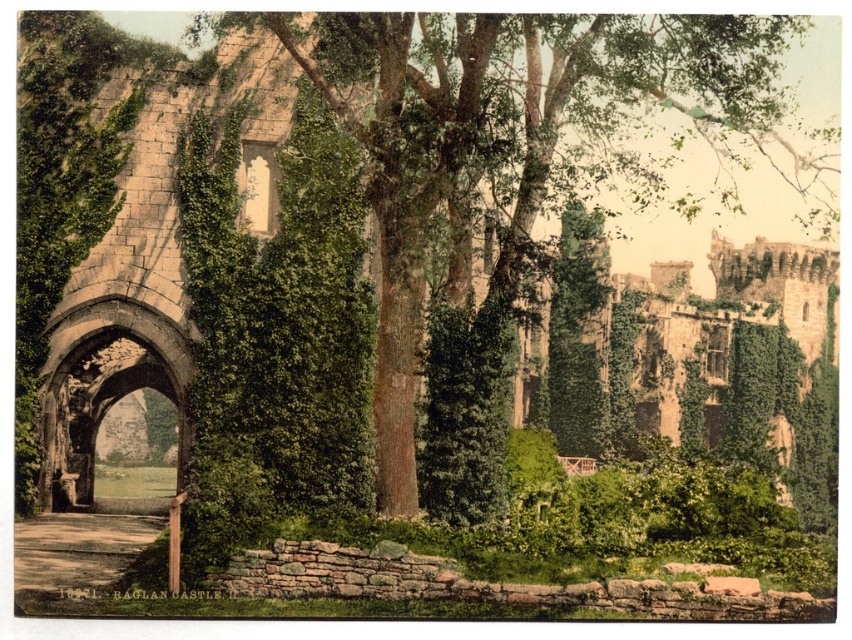
Is point (458, 234) less distant than point (79, 392)?

Yes, it is.

Is point (404, 442) positioned in front of point (81, 396)?

Yes, point (404, 442) is closer to viewer.

This screenshot has width=852, height=640. I want to click on green leafy tree at center, so pyautogui.click(x=511, y=138).

Is green leafy tree at center smaller than smooth concrete path at lower left?

Actually, green leafy tree at center might be larger than smooth concrete path at lower left.

Between green leafy tree at center and smooth concrete path at lower left, which one is positioned lower?

smooth concrete path at lower left is below.

What do you see at coordinates (511, 138) in the screenshot?
I see `green leafy tree at center` at bounding box center [511, 138].

You are a GUI agent. You are given a task and a screenshot of the screen. Output one action in this format:
    pyautogui.click(x=<x>, y=<y>)
    Task: Click on the green leafy tree at center
    This screenshot has width=852, height=640.
    Given the screenshot: What is the action you would take?
    pyautogui.click(x=511, y=138)

Does stone archway at center have a smaller size compared to smooth concrete path at lower left?

Incorrect, stone archway at center is not smaller in size than smooth concrete path at lower left.

Consider the image. Is stone archway at center above smooth concrete path at lower left?

Indeed, stone archway at center is positioned over smooth concrete path at lower left.

Describe the element at coordinates (104, 387) in the screenshot. I see `stone archway at center` at that location.

Identify the location of stone archway at center. Image resolution: width=852 pixels, height=640 pixels. (104, 387).